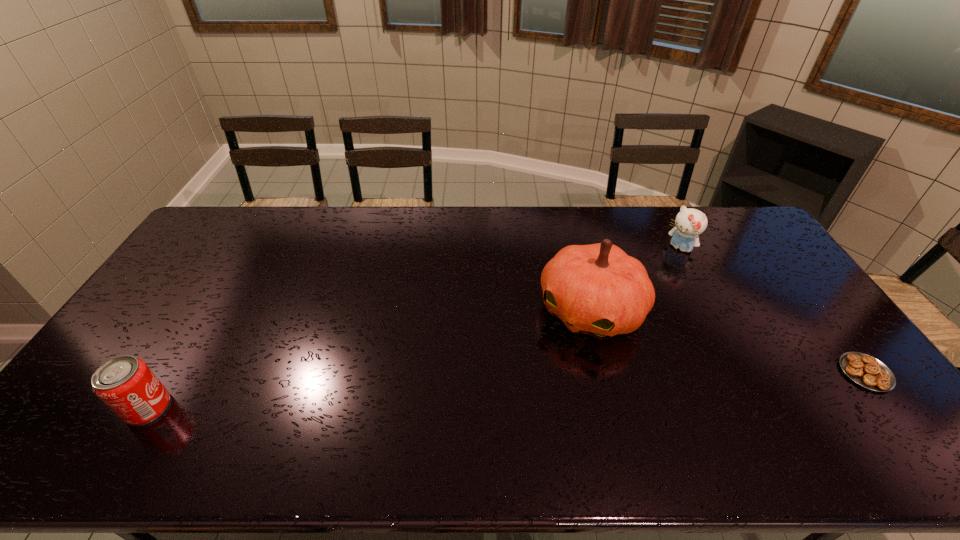
Identify the location of free space that is in between the leftmost object and the third nearest object. (370, 360).

Locate an element on the screen. The height and width of the screenshot is (540, 960). vacant area that lies between the can and the rightmost object is located at coordinates (507, 390).

Locate an element on the screen. The image size is (960, 540). empty location between the can and the pumpkin is located at coordinates (370, 360).

Locate an element on the screen. vacant area between the pumpkin and the shortest object is located at coordinates (729, 342).

Where is `empty space that is in between the second object from left to right and the rightmost object`? The width and height of the screenshot is (960, 540). empty space that is in between the second object from left to right and the rightmost object is located at coordinates (729, 342).

This screenshot has width=960, height=540. I want to click on empty space between the second object from left to right and the leftmost object, so click(370, 360).

Locate an element on the screen. vacant area that lies between the third nearest object and the rightmost object is located at coordinates (729, 342).

Locate which object ranks in proximity to the third object from left to right. Please provide its 2D coordinates. Your answer should be formatted as a tuple, i.e. [(x, y)], where the tuple contains the x and y coordinates of a point satisfying the conditions above.

[(597, 289)]

Select which object appears as the closest to the third nearest object. Please provide its 2D coordinates. Your answer should be formatted as a tuple, i.e. [(x, y)], where the tuple contains the x and y coordinates of a point satisfying the conditions above.

[(690, 223)]

Identify the location of vacant space that satisfies the following two spatial constraints: 1. on the back side of the leftmost object; 2. on the left side of the second object from right to left. (246, 249).